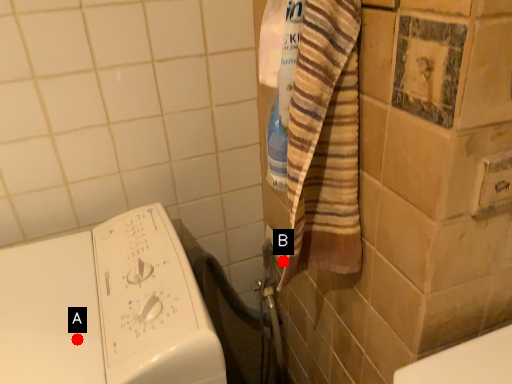
Question: Two points are circled on the image, labeled by A and B beside each circle. Which point is farther to the camera?

Choices:
 (A) A is further
 (B) B is further

Answer: (B)